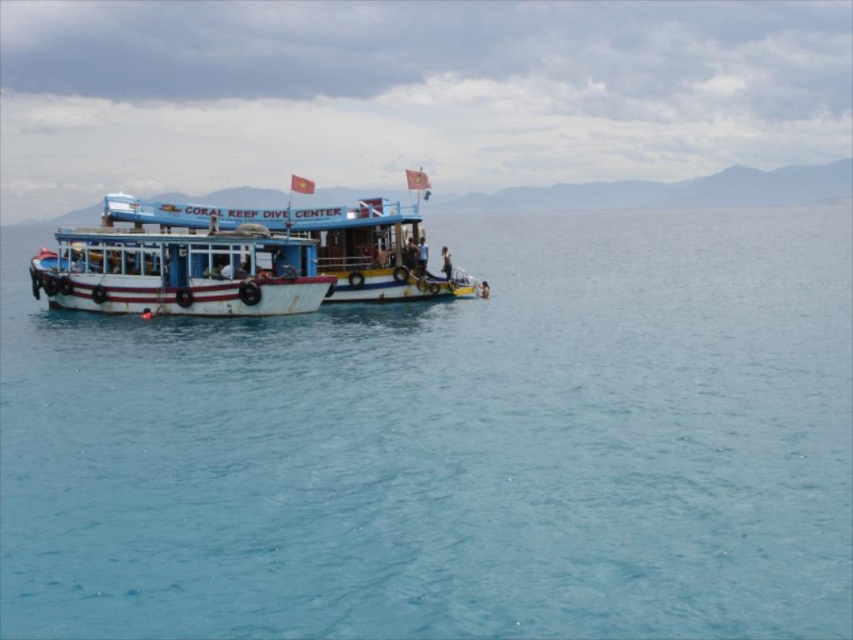
Is blue water at center behind white matte boat at center?

That is False.

Can you confirm if blue water at center is bigger than white matte boat at center?

Yes, blue water at center is bigger than white matte boat at center.

What do you see at coordinates (451, 445) in the screenshot?
I see `blue water at center` at bounding box center [451, 445].

Where is `blue water at center`? The height and width of the screenshot is (640, 853). blue water at center is located at coordinates (451, 445).